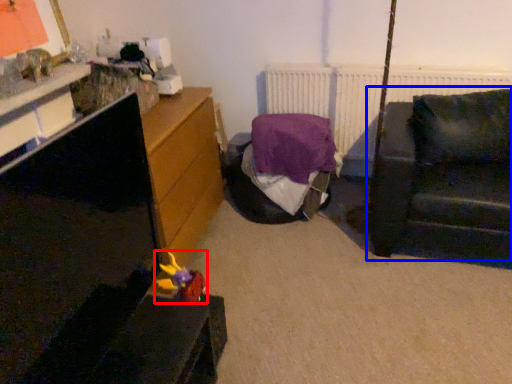
Question: Which point is further to the camera, toy (highlighted by a red box) or studio couch (highlighted by a blue box)?

Choices:
 (A) toy
 (B) studio couch

Answer: (B)